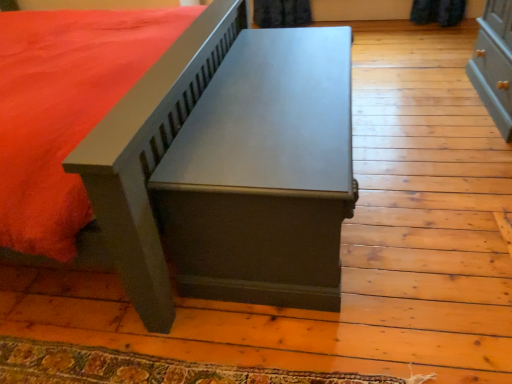
Describe the element at coordinates (226, 169) in the screenshot. The width and height of the screenshot is (512, 384). I see `matte gray bench at center` at that location.

You are a GUI agent. You are given a task and a screenshot of the screen. Output one action in this format:
    pyautogui.click(x=<x>, y=<y>)
    Task: Click on the matte gray bench at center
    The image size is (512, 384).
    Given the screenshot: What is the action you would take?
    pyautogui.click(x=226, y=169)

This screenshot has height=384, width=512. Identify the location of matte gray bench at center. (226, 169).